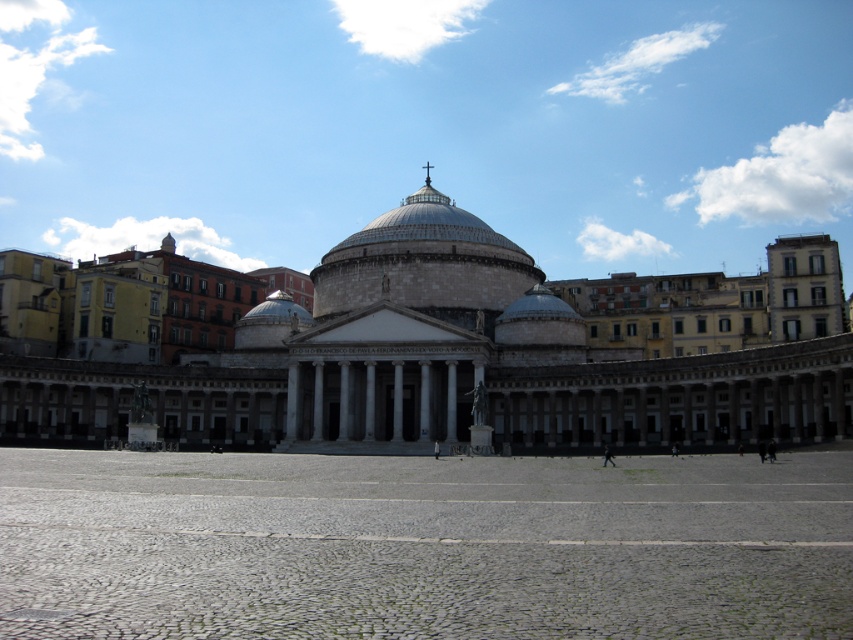
Question: Is white marble building at center thinner than white stone dome at center?

Choices:
 (A) yes
 (B) no

Answer: (B)

Question: Is white marble building at center wider than white stone dome at center?

Choices:
 (A) no
 (B) yes

Answer: (B)

Question: From the image, what is the correct spatial relationship of white marble building at center in relation to white stone dome at center?

Choices:
 (A) above
 (B) below

Answer: (B)

Question: Which object appears farthest from the camera in this image?

Choices:
 (A) white stone dome at center
 (B) white marble building at center

Answer: (A)